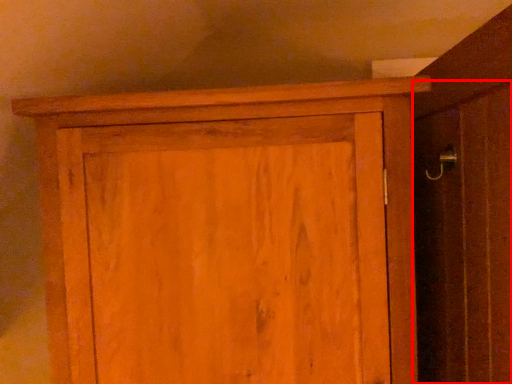
Question: In this image, where is screen door (annotated by the red box) located relative to cupboard?

Choices:
 (A) left
 (B) right

Answer: (B)